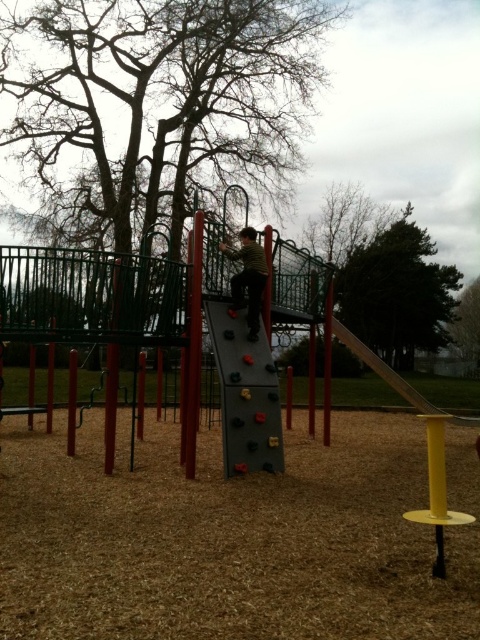
You are a parent trying to guide your child to climb the playground structure. You see the smooth red pole at center and the yellow metallic pole at right. Which pole should your child grab first to start climbing?

The smooth red pole at center should be grabbed first since it is positioned above the yellow metallic pole at right, making it the starting point for climbing.

Consider the image. You are a parent looking for your child who is wearing a striped shirt. According to the image, where would you find the striped shirt at center in the playground scene?

The striped shirt at center is located at point (248, 278) in the image coordinates.